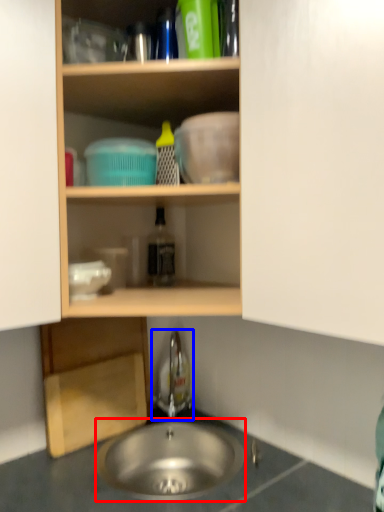
Question: Which of the following is the closest to the observer, sink (highlighted by a red box) or faucet (highlighted by a blue box)?

Choices:
 (A) sink
 (B) faucet

Answer: (A)